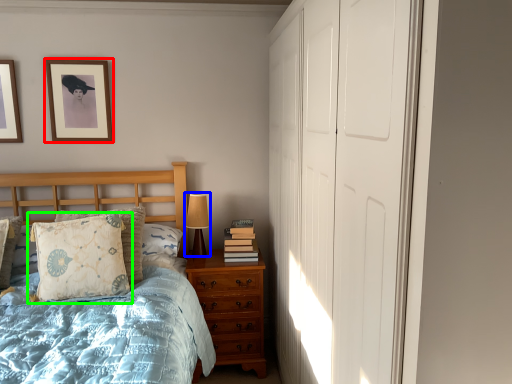
Question: Considering the real-world distances, which object is farthest from picture frame (highlighted by a red box)? table lamp (highlighted by a blue box) or pillow (highlighted by a green box)?

Choices:
 (A) table lamp
 (B) pillow

Answer: (A)